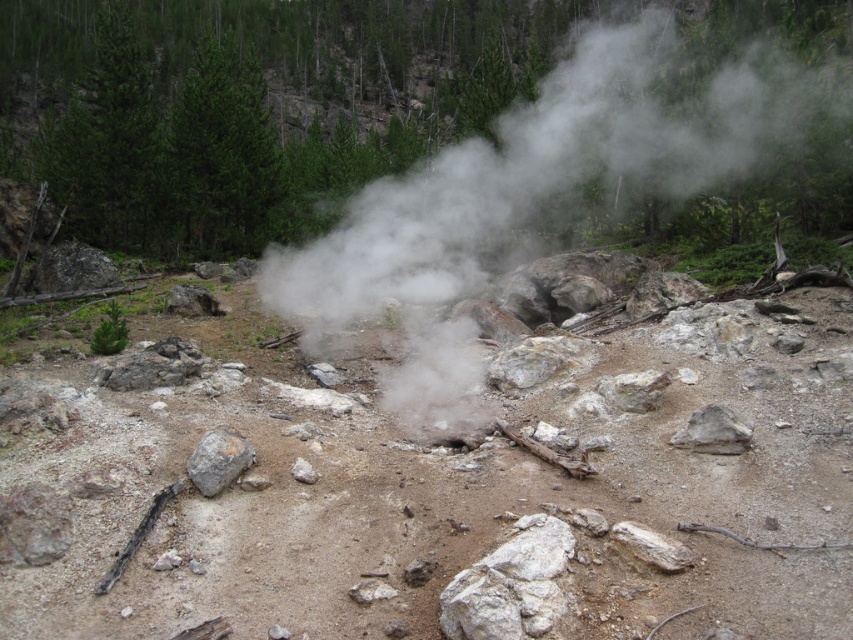
Can you confirm if white steam at center is wider than gray rough rock at center-right?

Yes.

Which of these two, white steam at center or gray rough rock at center-right, stands shorter?

gray rough rock at center-right is shorter.

Who is more distant from viewer, [643,179] or [712,406]?

The point [643,179] is more distant.

At what (x,y) coordinates should I click in order to perform the action: click on white steam at center. Please return your answer as a coordinate pair (x, y). Looking at the image, I should click on (523, 202).

Measure the distance between white steam at center and camera.

7.77 meters

Does white steam at center have a lesser height compared to gray rough rock at lower left?

No, white steam at center is not shorter than gray rough rock at lower left.

Does point (424, 300) come in front of point (202, 451)?

No, it is not.

Find the location of a particular element. The image size is (853, 640). white steam at center is located at coordinates (523, 202).

Can you confirm if gray rough rock at lower left is wider than gray rough rock at center-right?

In fact, gray rough rock at lower left might be narrower than gray rough rock at center-right.

Does gray rough rock at lower left appear over gray rough rock at center-right?

No, gray rough rock at lower left is not above gray rough rock at center-right.

At what (x,y) coordinates should I click in order to perform the action: click on gray rough rock at lower left. Please return your answer as a coordinate pair (x, y). Looking at the image, I should click on (218, 460).